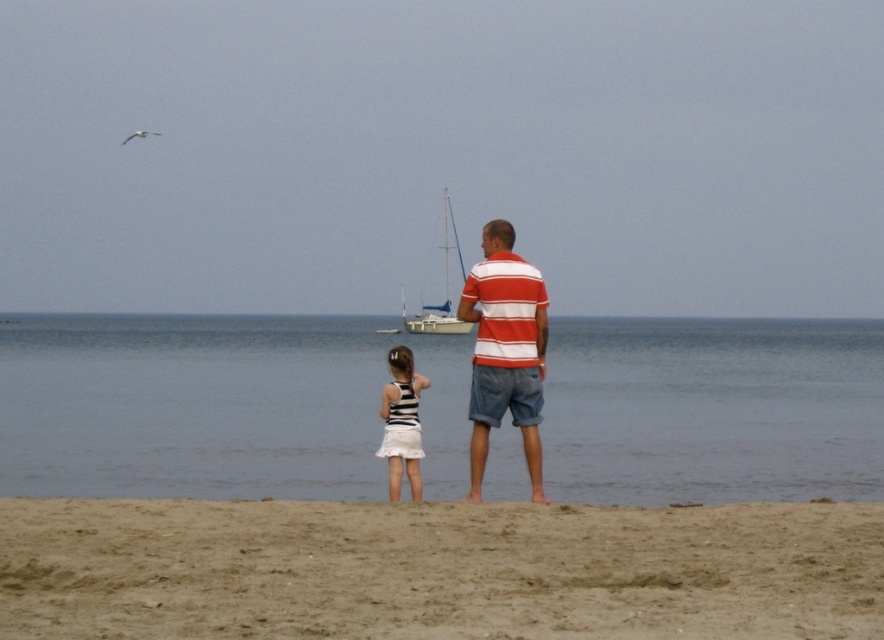
Measure the distance between point (66, 346) and camera.

Point (66, 346) and camera are 95.77 meters apart from each other.

How distant is blue water at center from brown sandy beach at lower center?

blue water at center is 214.50 feet away from brown sandy beach at lower center.

Is point (362, 317) in front of point (378, 557)?

No, it is not.

Identify the location of blue water at center. This screenshot has width=884, height=640. (216, 406).

Which of these two, brown sandy beach at lower center or striped cotton shirt at center, stands taller?

With more height is striped cotton shirt at center.

Between point (306, 566) and point (542, 328), which one is positioned in front?

Point (306, 566) is more forward.

This screenshot has width=884, height=640. I want to click on brown sandy beach at lower center, so click(x=437, y=570).

Who is higher up, striped cotton shirt at center or striped fabric dress at center?

Positioned higher is striped cotton shirt at center.

Is point (543, 310) farther from viewer compared to point (382, 440)?

That is False.

Locate an element on the screen. striped cotton shirt at center is located at coordinates (505, 349).